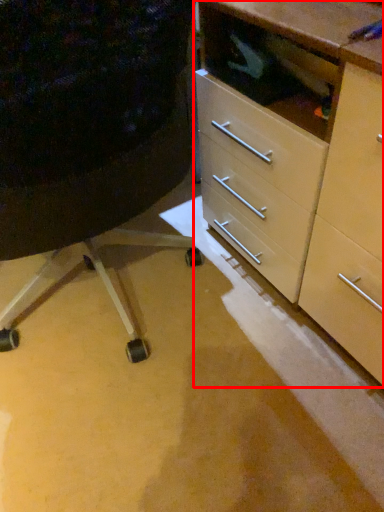
Question: From the image's perspective, what is the correct spatial positioning of chest of drawers (annotated by the red box) in reference to furniture?

Choices:
 (A) below
 (B) above

Answer: (B)